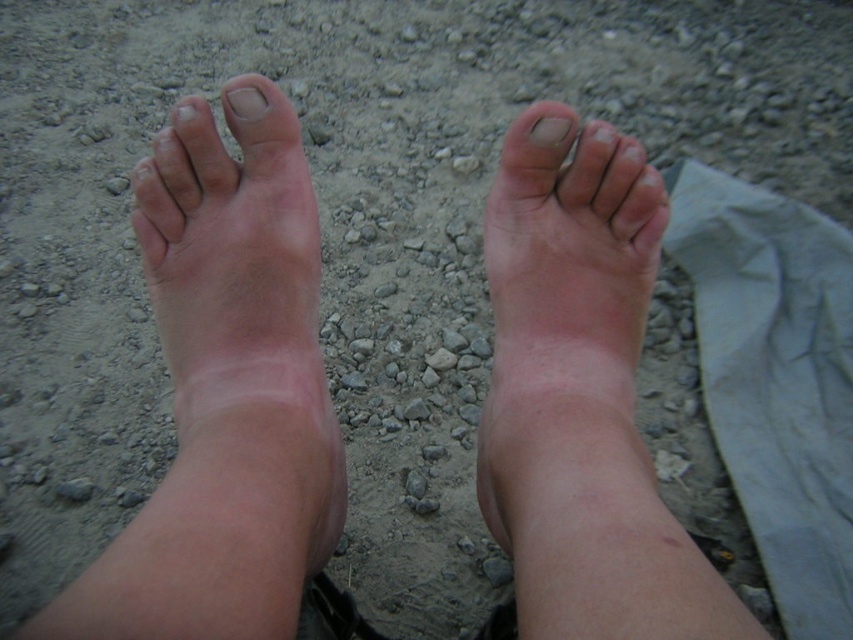
Question: Observing the image, what is the correct spatial positioning of pink smooth skin at center in reference to matte skin toe at center?

Choices:
 (A) left
 (B) right

Answer: (A)

Question: Can you confirm if pink smooth skin at center is positioned to the right of nail at center?

Choices:
 (A) yes
 (B) no

Answer: (A)

Question: Which point is farther from the camera taking this photo?

Choices:
 (A) (549, 132)
 (B) (224, 99)
 (C) (653, 474)
 (D) (257, 547)

Answer: (B)

Question: Among these points, which one is nearest to the camera?

Choices:
 (A) (173, 314)
 (B) (625, 500)
 (C) (541, 141)

Answer: (B)

Question: Is pink skin at center closer to camera compared to nail at center?

Choices:
 (A) yes
 (B) no

Answer: (A)

Question: Among these points, which one is farthest from the camera?

Choices:
 (A) (541, 125)
 (B) (212, 372)

Answer: (A)